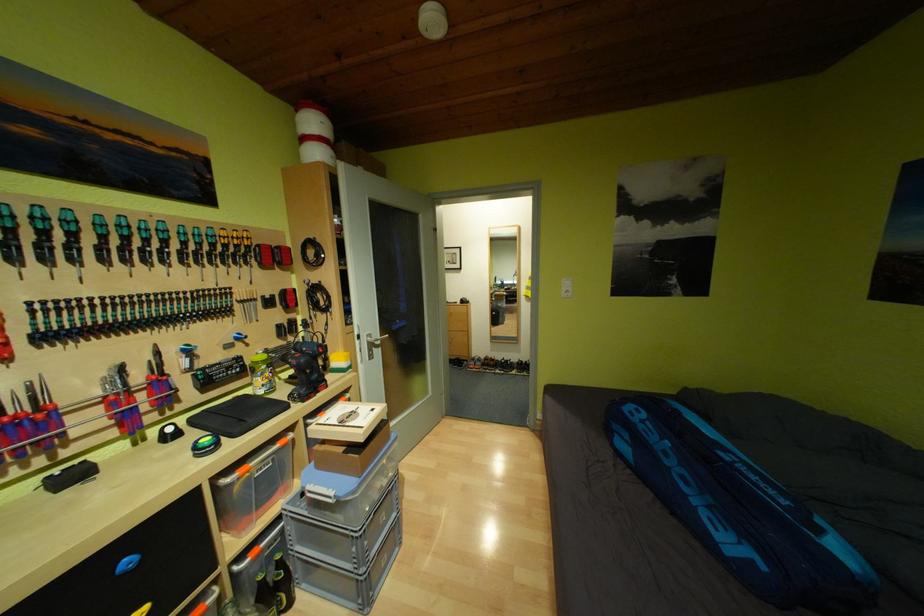
Find where to lift the blue tennis bag. Please return your answer as a coordinate pair (x, y).

(737, 509)